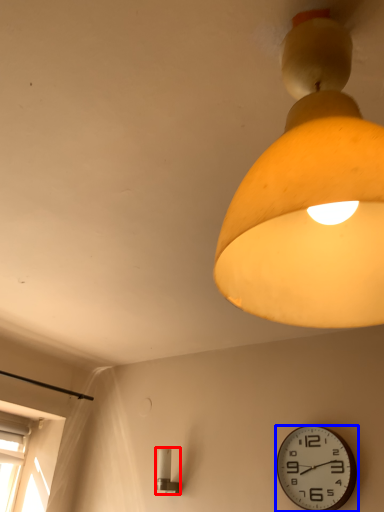
Question: Which object appears closest to the camera in this image, lamp (highlighted by a red box) or wall clock (highlighted by a blue box)?

Choices:
 (A) lamp
 (B) wall clock

Answer: (B)